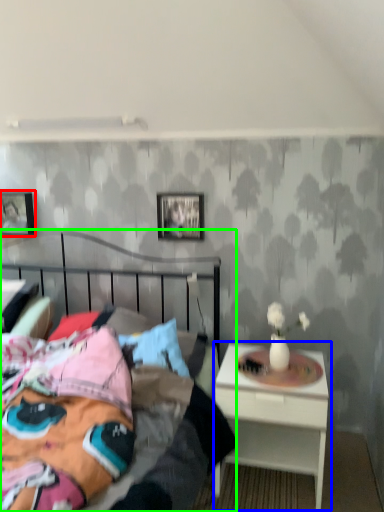
Question: Which object is positioned farthest from picture frame (highlighted by a red box)? Select from nightstand (highlighted by a blue box) and bed (highlighted by a green box).

Choices:
 (A) nightstand
 (B) bed

Answer: (A)